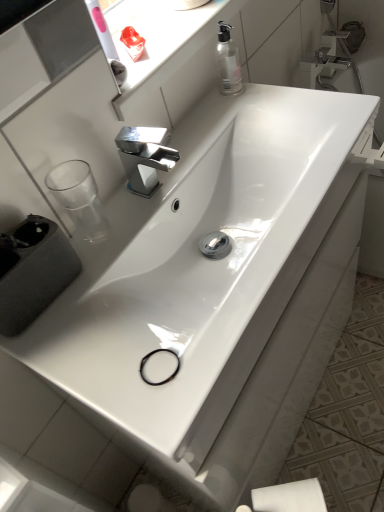
Find the location of a particular element. This screenshot has height=512, width=384. free space on the front side of transparent plastic soap dispenser at upper right is located at coordinates (253, 113).